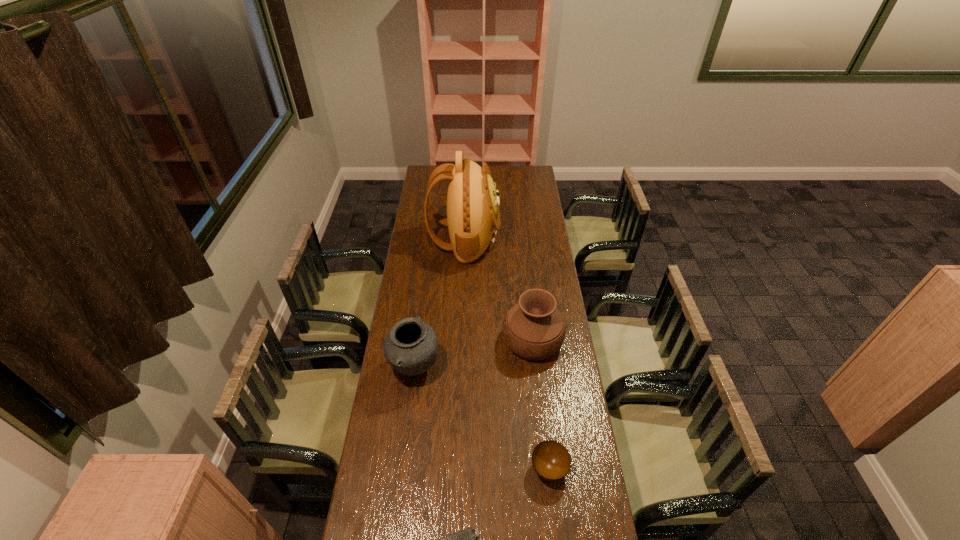
You are a GUI agent. You are given a task and a screenshot of the screen. Output one action in this format:
    pyautogui.click(x=<x>, y=<y>)
    Task: Click on the vacant space that is in between the left urn and the second shortest object
    
    Given the screenshot: What is the action you would take?
    coord(482,418)

Where is `vacant region between the left urn and the tallest object`? The width and height of the screenshot is (960, 540). vacant region between the left urn and the tallest object is located at coordinates (440, 303).

The image size is (960, 540). Identify the location of vacant area between the backpack and the left urn. (440, 303).

Identify the location of empty location between the tallest object and the right urn. (498, 290).

Find the location of a particular element. blank region between the tallest object and the left urn is located at coordinates (440, 303).

Identify which object is the second nearest to the right urn. Please provide its 2D coordinates. Your answer should be formatted as a tuple, i.e. [(x, y)], where the tuple contains the x and y coordinates of a point satisfying the conditions above.

[(473, 217)]

At what (x,y) coordinates should I click in order to perform the action: click on the third closest object relative to the bowl. Please return your answer as a coordinate pair (x, y). This screenshot has height=540, width=960. Looking at the image, I should click on (411, 346).

You are a GUI agent. You are given a task and a screenshot of the screen. Output one action in this format:
    pyautogui.click(x=<x>, y=<y>)
    Task: Click on the free space that satisfies the following two spatial constraints: 1. on the front side of the fourth farthest object; 2. on the left side of the right urn
    The image size is (960, 540).
    Given the screenshot: What is the action you would take?
    pyautogui.click(x=546, y=469)

Find the location of a particular element. Image resolution: width=960 pixels, height=540 pixels. free point that satisfies the following two spatial constraints: 1. on the front side of the second shortest object; 2. on the right side of the right urn is located at coordinates (546, 469).

Locate an element on the screen. This screenshot has width=960, height=540. vacant area that satisfies the following two spatial constraints: 1. on the front side of the right urn; 2. on the right side of the second nearest object is located at coordinates point(546,469).